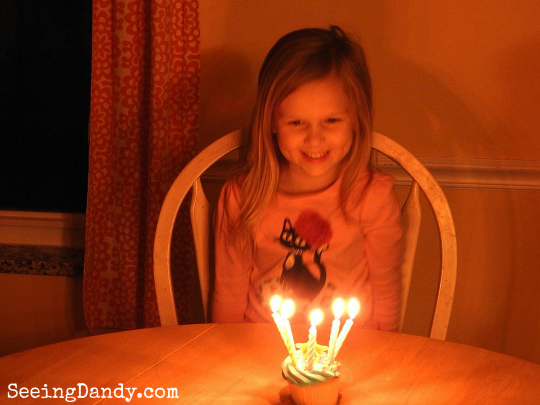
Image resolution: width=540 pixels, height=405 pixels. In order to click on candle in this screenshot , I will do `click(276, 320)`, `click(289, 334)`, `click(310, 336)`, `click(330, 335)`, `click(346, 336)`.